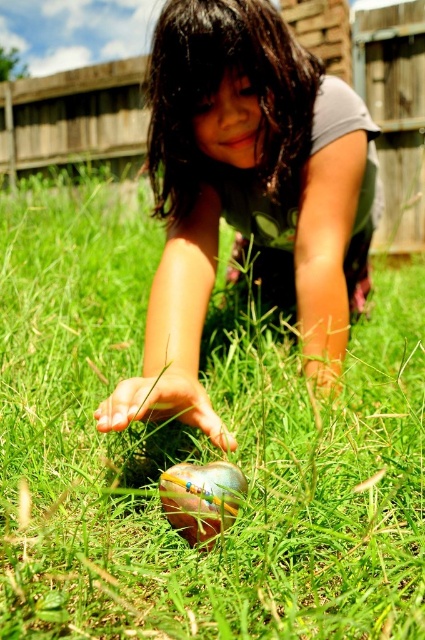
Question: Where is matte green dress at center located in relation to shiny metallic ball at center in the image?

Choices:
 (A) right
 (B) left

Answer: (A)

Question: Which point is closer to the camera?

Choices:
 (A) (204, 51)
 (B) (189, 484)

Answer: (B)

Question: Does matte green dress at center have a lesser width compared to shiny metallic ball at center?

Choices:
 (A) no
 (B) yes

Answer: (A)

Question: Which point is closer to the camera?

Choices:
 (A) (166, 172)
 (B) (176, 497)

Answer: (B)

Question: Among these points, which one is nearest to the camera?

Choices:
 (A) (210, 472)
 (B) (181, 408)

Answer: (A)

Question: Is matte green dress at center smaller than shiny metallic ball at center?

Choices:
 (A) yes
 (B) no

Answer: (B)